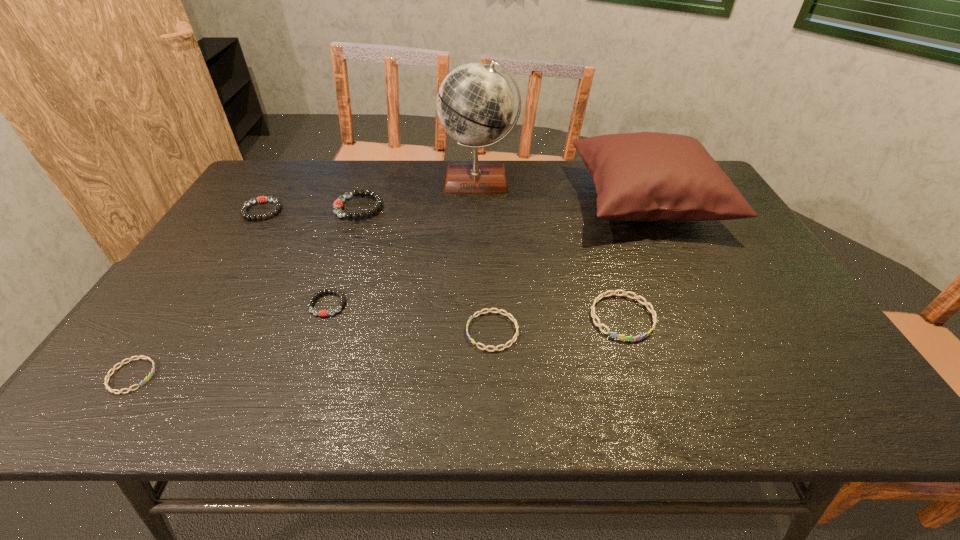
In the image, there is a desktop. Identify the location of vacant area at the near edge. The height and width of the screenshot is (540, 960). (356, 380).

This screenshot has width=960, height=540. In the image, there is a desktop. What are the coordinates of `vacant space at the right edge` in the screenshot? It's located at (703, 255).

Find the location of a particular element. The width and height of the screenshot is (960, 540). free space between the nearest black bracelet and the cushion is located at coordinates (487, 253).

Identify the location of empty space that is in between the tallest bracelet and the nearest object. The width and height of the screenshot is (960, 540). (246, 292).

Locate an element on the screen. free point between the biggest blue bracelet and the nearest blue bracelet is located at coordinates (377, 347).

Identify the location of free spot between the leftmost black bracelet and the third tallest object. [311, 209].

Find the location of a particular element. This screenshot has width=960, height=540. free space between the second blue bracelet from right to left and the cushion is located at coordinates (569, 266).

Locate an element on the screen. The height and width of the screenshot is (540, 960). empty location between the sixth shortest object and the leftmost black bracelet is located at coordinates (311, 209).

Find the location of a particular element. The image size is (960, 540). free point between the leftmost blue bracelet and the second tallest object is located at coordinates (389, 288).

Locate an element on the screen. Image resolution: width=960 pixels, height=540 pixels. vacant point located between the second smallest black bracelet and the nearest black bracelet is located at coordinates pos(295,258).